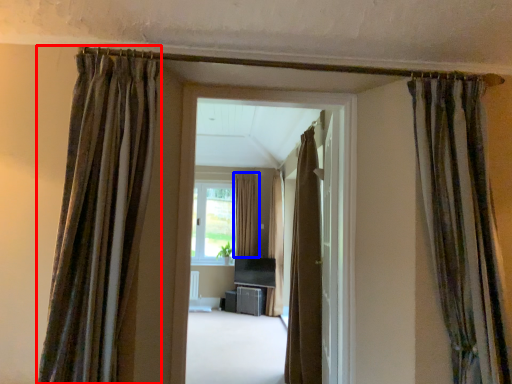
Question: Which point is closer to the camera, curtain (highlighted by a red box) or curtain (highlighted by a blue box)?

Choices:
 (A) curtain
 (B) curtain

Answer: (A)